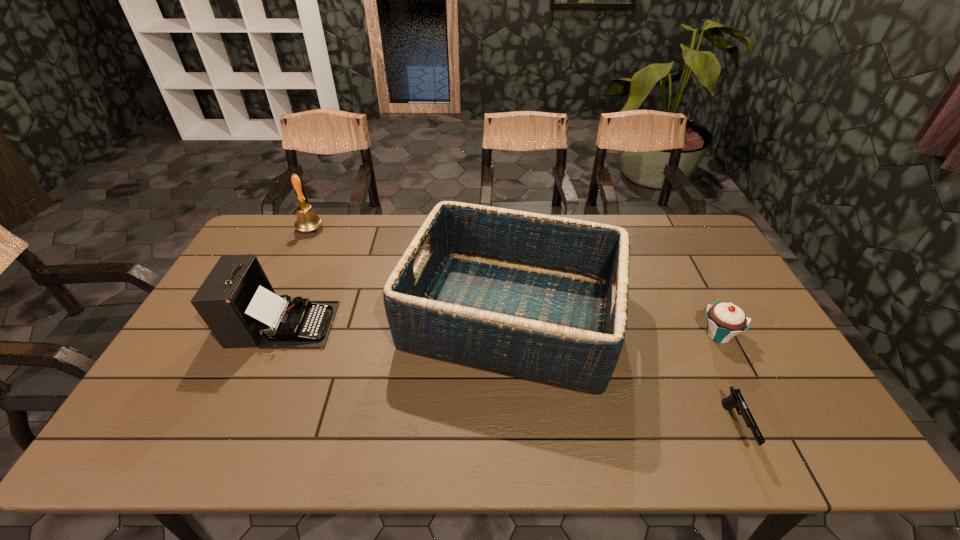
This screenshot has height=540, width=960. What are the coordinates of `the farthest object` in the screenshot? It's located at (307, 220).

The height and width of the screenshot is (540, 960). Find the location of `the third object from left to right`. the third object from left to right is located at coordinates (544, 298).

This screenshot has width=960, height=540. I want to click on typewriter, so click(x=237, y=302).

Find the location of `the fourth tallest object`. the fourth tallest object is located at coordinates (724, 320).

This screenshot has height=540, width=960. Identify the location of the rightmost object. (724, 320).

The width and height of the screenshot is (960, 540). Identify the location of gun. (735, 400).

Find the location of `the shortest object`. the shortest object is located at coordinates (735, 400).

At what (x,y) coordinates should I click in order to perform the action: click on vacant space located on the right of the bell. Please return your answer as a coordinate pair (x, y). Image resolution: width=960 pixels, height=540 pixels. Looking at the image, I should click on (363, 230).

Find the location of a particular element. The height and width of the screenshot is (540, 960). vacant space located on the right of the basket is located at coordinates (738, 316).

You are a GUI agent. You are given a task and a screenshot of the screen. Output one action in this format:
    pyautogui.click(x=<x>, y=<y>)
    Task: Click on the vacant space situated inside the open case of the typewriter
    
    Given the screenshot: What is the action you would take?
    pyautogui.click(x=417, y=325)